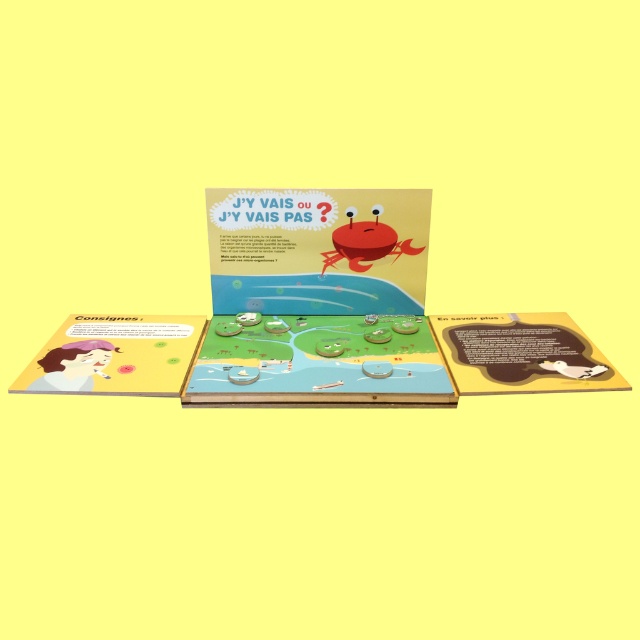
Question: Can you confirm if matte plastic game board at center is thinner than brown matte book at lower right?

Choices:
 (A) no
 (B) yes

Answer: (A)

Question: Where is matte plastic game board at center located in relation to matte yellow paper at lower left in the image?

Choices:
 (A) above
 (B) below

Answer: (B)

Question: Which object is positioned farthest from the matte yellow paper at lower left?

Choices:
 (A) brown matte book at lower right
 (B) matte plastic game board at center

Answer: (A)

Question: Which of the following is the farthest from the observer?

Choices:
 (A) (202, 321)
 (B) (528, 374)

Answer: (A)

Question: Among these points, which one is nearest to the camera?

Choices:
 (A) (104, 333)
 (B) (272, 333)
 (C) (516, 314)

Answer: (A)

Question: Can you confirm if matte yellow paper at lower left is smaller than brown matte book at lower right?

Choices:
 (A) yes
 (B) no

Answer: (A)